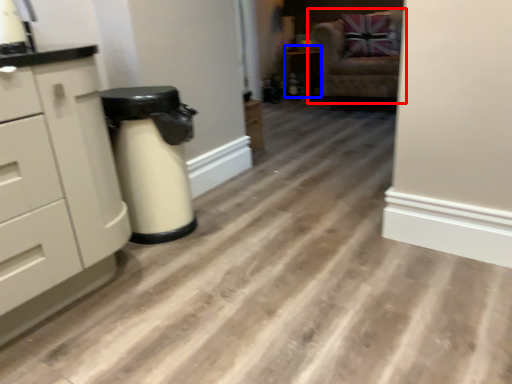
Question: Among these objects, which one is nearest to the camera, chair (highlighted by a red box) or cabinetry (highlighted by a blue box)?

Choices:
 (A) chair
 (B) cabinetry

Answer: (A)